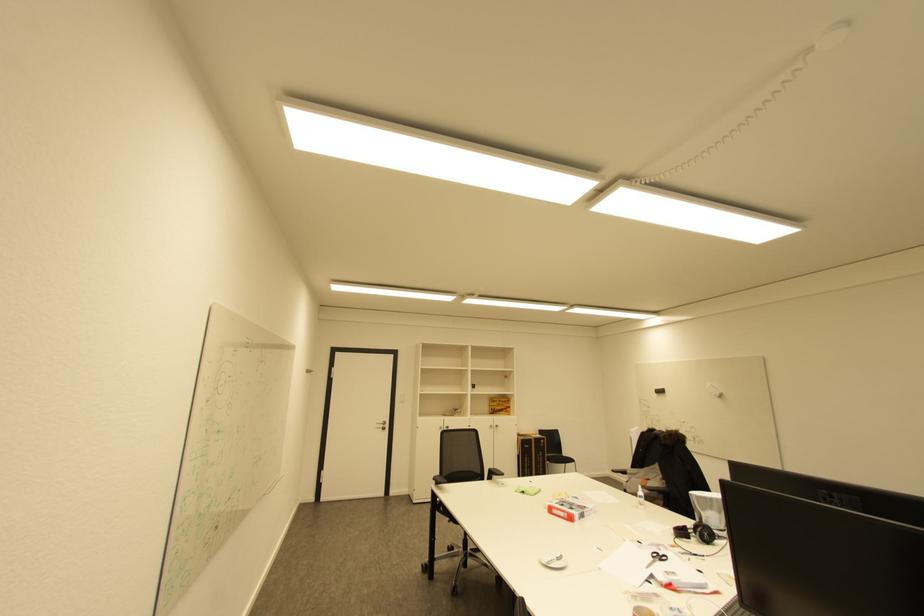
Find the location of a particular element. The image size is (924, 616). black cardboard box is located at coordinates (530, 455).